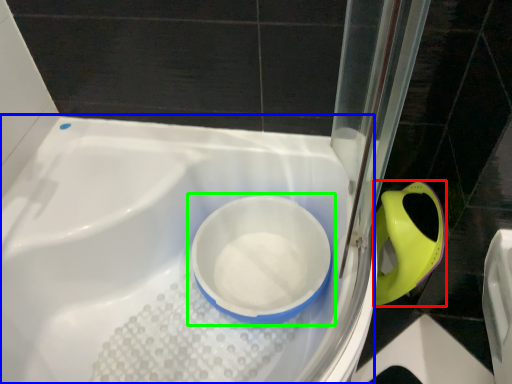
Question: Based on their relative distances, which object is farther from bidet (highlighted by a red box)? Choose from bath (highlighted by a blue box) and toilet (highlighted by a green box).

Choices:
 (A) bath
 (B) toilet

Answer: (A)